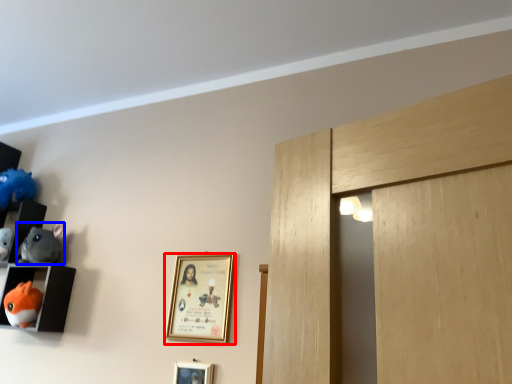
Question: Among these objects, which one is nearest to the camera, picture frame (highlighted by a red box) or toy (highlighted by a blue box)?

Choices:
 (A) picture frame
 (B) toy

Answer: (A)